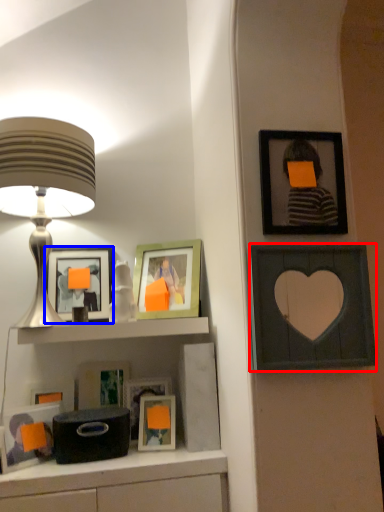
Question: Which object appears farthest to the camera in this image, picture frame (highlighted by a red box) or picture frame (highlighted by a blue box)?

Choices:
 (A) picture frame
 (B) picture frame

Answer: (B)